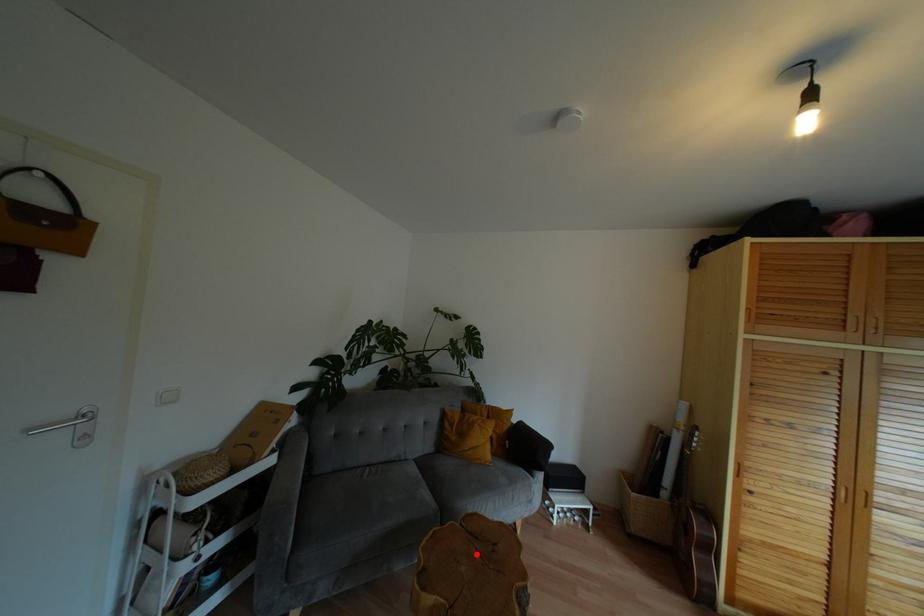
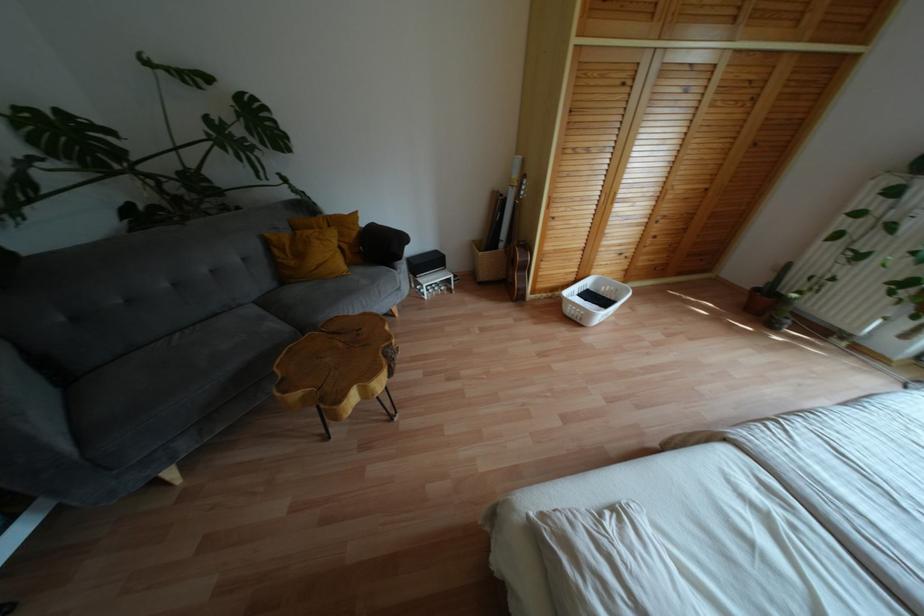
Locate, in the second image, the point that corresponds to the highlighted location in the first image.

(341, 344)